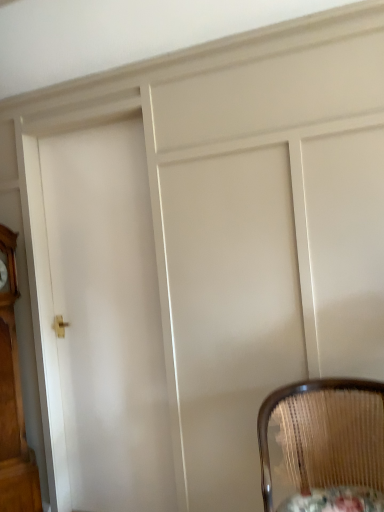
Measure the distance between woven wood chair at lower right and camera.

woven wood chair at lower right is 4.05 feet from camera.

In order to click on wooden textured round table at lower right in this screenshot , I will do `click(335, 500)`.

Where is `woven wood chair at lower right`? The image size is (384, 512). woven wood chair at lower right is located at coordinates click(x=325, y=434).

Can we say wooden textured round table at lower right lies outside wooden grandfather clock at left?

Absolutely, wooden textured round table at lower right is external to wooden grandfather clock at left.

Based on the photo, does wooden textured round table at lower right appear on the right side of wooden grandfather clock at left?

Indeed, wooden textured round table at lower right is positioned on the right side of wooden grandfather clock at left.

In the image, there is a wooden textured round table at lower right. Where is `furniture above it (from the image's perspective)`? furniture above it (from the image's perspective) is located at coordinates (13, 402).

Consider the image. Does white glossy door at center come behind woven wood chair at lower right?

That is True.

Is point (146, 259) closer to camera compared to point (380, 479)?

No.

Is white glossy door at center taller than woven wood chair at lower right?

Correct, white glossy door at center is much taller as woven wood chair at lower right.

Consider the image. Is white glossy door at center with woven wood chair at lower right?

There is a gap between white glossy door at center and woven wood chair at lower right.

Considering the relative sizes of wooden textured round table at lower right and woven wood chair at lower right in the image provided, is wooden textured round table at lower right shorter than woven wood chair at lower right?

Correct, wooden textured round table at lower right is not as tall as woven wood chair at lower right.

Considering the positions of objects wooden textured round table at lower right and woven wood chair at lower right in the image provided, who is more to the right, wooden textured round table at lower right or woven wood chair at lower right?

Positioned to the right is wooden textured round table at lower right.

Measure the distance from wooden textured round table at lower right to woven wood chair at lower right.

Answer: wooden textured round table at lower right is 6.64 inches from woven wood chair at lower right.

Is wooden textured round table at lower right looking in the opposite direction of woven wood chair at lower right?

Correct, wooden textured round table at lower right is looking away from woven wood chair at lower right.

Is woven wood chair at lower right directly adjacent to white glossy door at center?

No, woven wood chair at lower right is not touching white glossy door at center.

Considering the relative sizes of woven wood chair at lower right and white glossy door at center in the image provided, is woven wood chair at lower right taller than white glossy door at center?

In fact, woven wood chair at lower right may be shorter than white glossy door at center.

Does woven wood chair at lower right have a larger size compared to white glossy door at center?

Yes.

From the image's perspective, does woven wood chair at lower right appear higher than white glossy door at center?

No, from the image's perspective, woven wood chair at lower right is not on top of white glossy door at center.

The height and width of the screenshot is (512, 384). I want to click on furniture that is above the woven wood chair at lower right (from a real-world perspective), so click(x=13, y=402).

Are woven wood chair at lower right and wooden grandfather clock at left located far from each other?

Indeed, woven wood chair at lower right is not near wooden grandfather clock at left.

Does woven wood chair at lower right appear on the left side of wooden grandfather clock at left?

Incorrect, woven wood chair at lower right is not on the left side of wooden grandfather clock at left.

Is woven wood chair at lower right completely or partially outside of wooden grandfather clock at left?

Yes, woven wood chair at lower right is located beyond the bounds of wooden grandfather clock at left.

Does woven wood chair at lower right have a lesser width compared to wooden textured round table at lower right?

Incorrect, the width of woven wood chair at lower right is not less than that of wooden textured round table at lower right.

From a real-world perspective, is woven wood chair at lower right physically above wooden textured round table at lower right?

Yes, from a real-world perspective, woven wood chair at lower right is on top of wooden textured round table at lower right.

Which object is positioned more to the left, woven wood chair at lower right or wooden textured round table at lower right?

woven wood chair at lower right is more to the left.

Is point (323, 444) behind point (318, 508)?

Yes, it is.

Does white glossy door at center touch wooden grandfather clock at left?

No, white glossy door at center is not touching wooden grandfather clock at left.

From the image's perspective, is white glossy door at center over wooden grandfather clock at left?

Yes, from the image's perspective, white glossy door at center is over wooden grandfather clock at left.

Is white glossy door at center to the left or to the right of wooden grandfather clock at left in the image?

white glossy door at center is positioned on wooden grandfather clock at left's right side.

From a real-world perspective, is white glossy door at center physically above wooden grandfather clock at left?

Yes, from a real-world perspective, white glossy door at center is above wooden grandfather clock at left.

Where is `round table in front of the wooden grandfather clock at left`? Image resolution: width=384 pixels, height=512 pixels. round table in front of the wooden grandfather clock at left is located at coordinates (335, 500).

Identify the location of chair on the right of white glossy door at center. (325, 434).

Which object lies nearer to the anchor point white glossy door at center, wooden grandfather clock at left or wooden textured round table at lower right?

Based on the image, wooden grandfather clock at left appears to be nearer to white glossy door at center.

Looking at this image, when comparing their distances from white glossy door at center, does wooden grandfather clock at left or woven wood chair at lower right seem closer?

Based on the image, wooden grandfather clock at left appears to be nearer to white glossy door at center.

Considering their positions, is wooden grandfather clock at left positioned further to woven wood chair at lower right than white glossy door at center?

Based on the image, wooden grandfather clock at left appears to be further to woven wood chair at lower right.

Looking at the image, which one is located closer to wooden textured round table at lower right, woven wood chair at lower right or white glossy door at center?

woven wood chair at lower right is closer to wooden textured round table at lower right.

Considering their positions, is white glossy door at center positioned closer to wooden grandfather clock at left than wooden textured round table at lower right?

The object closer to wooden grandfather clock at left is white glossy door at center.

Based on their spatial positions, is woven wood chair at lower right or wooden grandfather clock at left further from white glossy door at center?

Based on the image, woven wood chair at lower right appears to be further to white glossy door at center.

When comparing their distances from wooden grandfather clock at left, does wooden textured round table at lower right or white glossy door at center seem closer?

white glossy door at center.

Looking at this image, estimate the real-world distances between objects in this image. Which object is closer to white glossy door at center, woven wood chair at lower right or wooden textured round table at lower right?

Based on the image, woven wood chair at lower right appears to be nearer to white glossy door at center.

Identify the location of door between wooden grandfather clock at left and woven wood chair at lower right. This screenshot has height=512, width=384. (108, 318).

Find the location of `chair between white glossy door at center and wooden textured round table at lower right from left to right`. chair between white glossy door at center and wooden textured round table at lower right from left to right is located at coordinates (325, 434).

At what (x,y) coordinates should I click in order to perform the action: click on door located between wooden grandfather clock at left and wooden textured round table at lower right in the left-right direction. Please return your answer as a coordinate pair (x, y). This screenshot has width=384, height=512. Looking at the image, I should click on (108, 318).

Locate an element on the screen. This screenshot has width=384, height=512. chair between wooden grandfather clock at left and wooden textured round table at lower right from left to right is located at coordinates [325, 434].